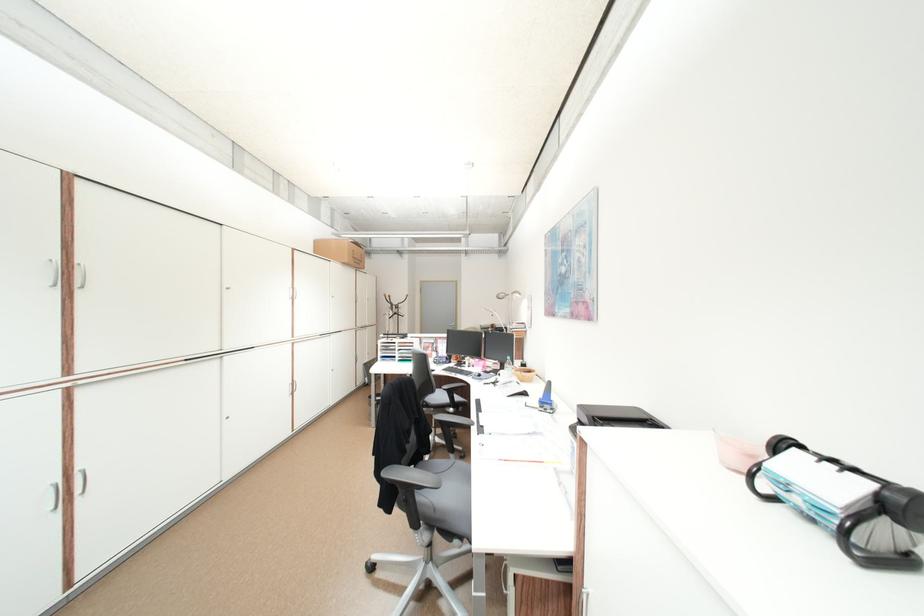
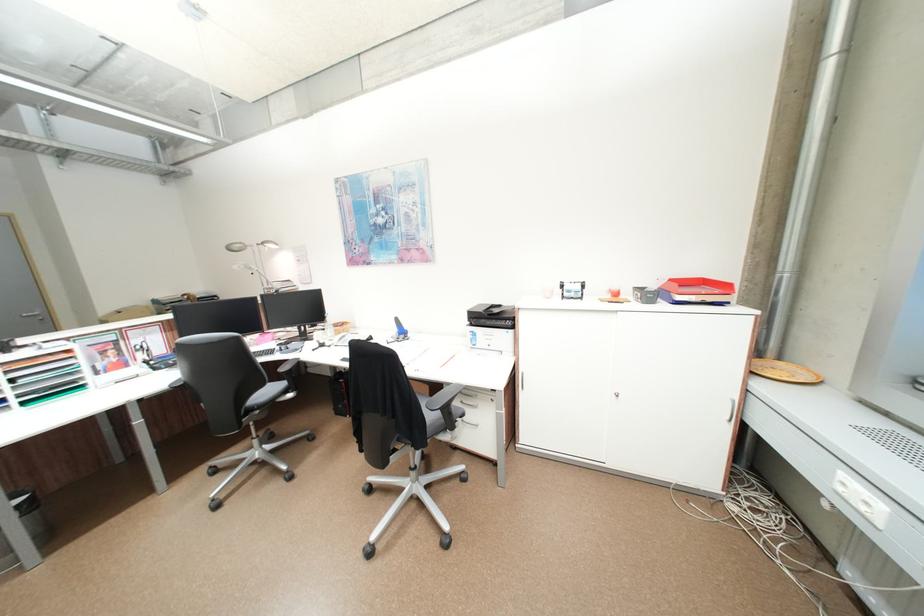
In the second image, find the point that corresponds to (527,296) in the first image.

(281, 246)